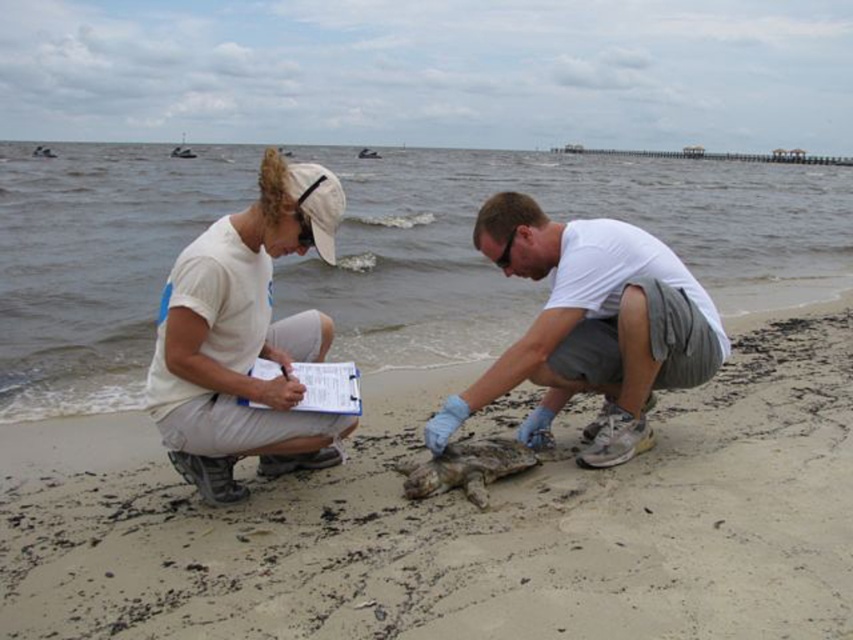
Who is more forward, [619,461] or [339,392]?

Positioned in front is point [339,392].

Who is more distant from viewer, (323,444) or (305,388)?

The point (323,444) is more distant.

Image resolution: width=853 pixels, height=640 pixels. Describe the element at coordinates (590, 326) in the screenshot. I see `matte gray turtle at center` at that location.

Find the location of a particular element. The width and height of the screenshot is (853, 640). matte gray turtle at center is located at coordinates (590, 326).

Between point (312, 179) and point (252, 218), which one is positioned behind?

The point (252, 218) is more distant.

Who is positioned more to the left, matte gray turtle at center or white matte clipboard at upper left?

Positioned to the left is white matte clipboard at upper left.

Where is `matte gray turtle at center`? This screenshot has width=853, height=640. matte gray turtle at center is located at coordinates (590, 326).

Between sandy beach at center and white paper clipboard at center, which one is positioned higher?

white paper clipboard at center is higher up.

Between sandy beach at center and white paper clipboard at center, which one has less height?

white paper clipboard at center is shorter.

Is point (105, 460) less distant than point (328, 385)?

No, (105, 460) is behind (328, 385).

At what (x,y) coordinates should I click in order to perform the action: click on sandy beach at center. Please return your answer as a coordinate pair (x, y). Looking at the image, I should click on (463, 522).